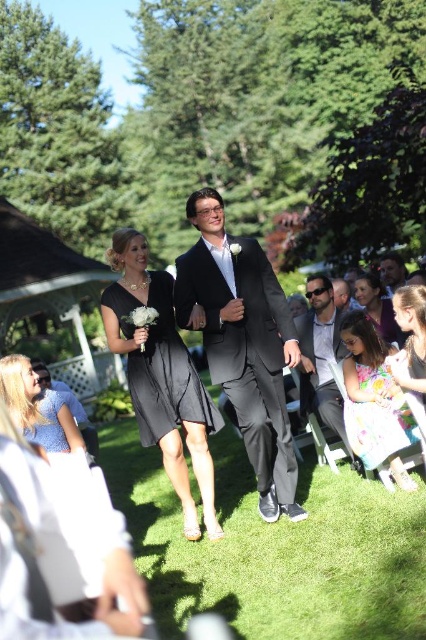
Looking at this image, you are a photographer at the wedding and need to capture a closeup shot of the blue cotton dress at lower left and the smooth gray suit at center. Which one will require you to zoom in more to fill the frame?

The blue cotton dress at lower left is larger in size than the smooth gray suit at center, so you will need to zoom in less to fill the frame for the blue cotton dress at lower left compared to the smooth gray suit at center.

You are standing at the center of the image and want to find the floral chiffon dress at lower right. According to the coordinate system where the bottom left corner is the origin, what direction should you look to locate it?

The floral chiffon dress at lower right is located at coordinate point 0.647 on the x axis and 0.883 on the y axis. Since the origin is at the bottom left, the x value of 0.647 indicates a position to the right, and the y value of 0.883 indicates a position closer to the bottom. Therefore, you should look to the lower right direction to locate the floral chiffon dress at lower right.

From the picture: You are standing at the point marked by the coordinate point (376, 413) in the wedding scene. Looking around, you notice the floral chiffon dress at lower right. Which direction should you face to see the bride and groom walking down the aisle?

The point (376, 413) marks the floral chiffon dress at lower right. Since the bride and groom are walking down the grassy aisle in the foreground, you should face towards the center of the image to see them.